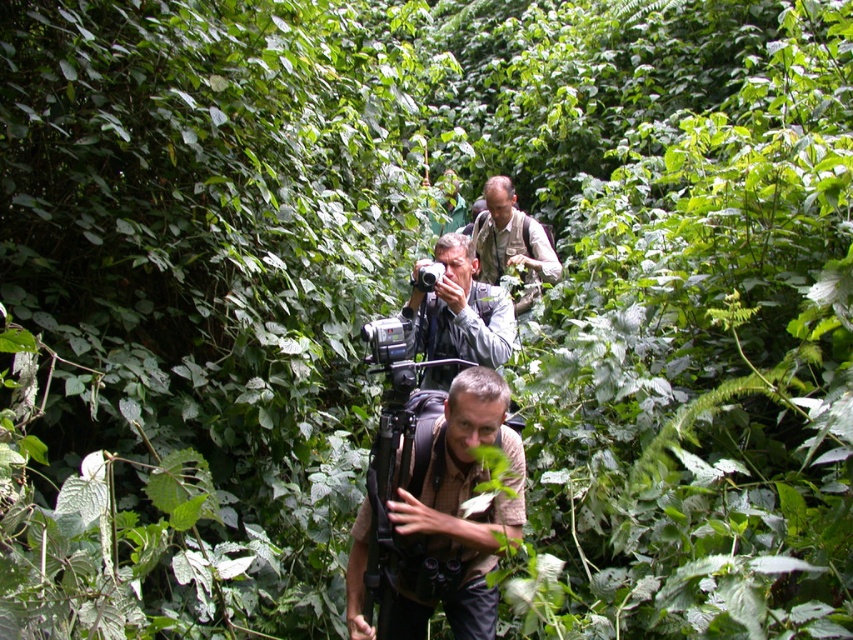
Question: Does brown fabric backpack at center have a lesser width compared to matte gray camera at center?

Choices:
 (A) no
 (B) yes

Answer: (A)

Question: Considering the relative positions of brown fabric backpack at center and khaki fabric shirt at center in the image provided, where is brown fabric backpack at center located with respect to khaki fabric shirt at center?

Choices:
 (A) left
 (B) right

Answer: (A)

Question: Can you confirm if matte gray camera at center is positioned to the left of khaki fabric shirt at center?

Choices:
 (A) yes
 (B) no

Answer: (A)

Question: Which object appears closest to the camera in this image?

Choices:
 (A) matte gray camera at center
 (B) khaki fabric shirt at center
 (C) brown fabric backpack at center

Answer: (C)

Question: Which object is farther from the camera taking this photo?

Choices:
 (A) khaki fabric shirt at center
 (B) brown fabric backpack at center
 (C) matte gray camera at center

Answer: (A)

Question: Which of the following is the closest to the observer?

Choices:
 (A) (520, 234)
 (B) (432, 291)
 (C) (395, 621)

Answer: (C)